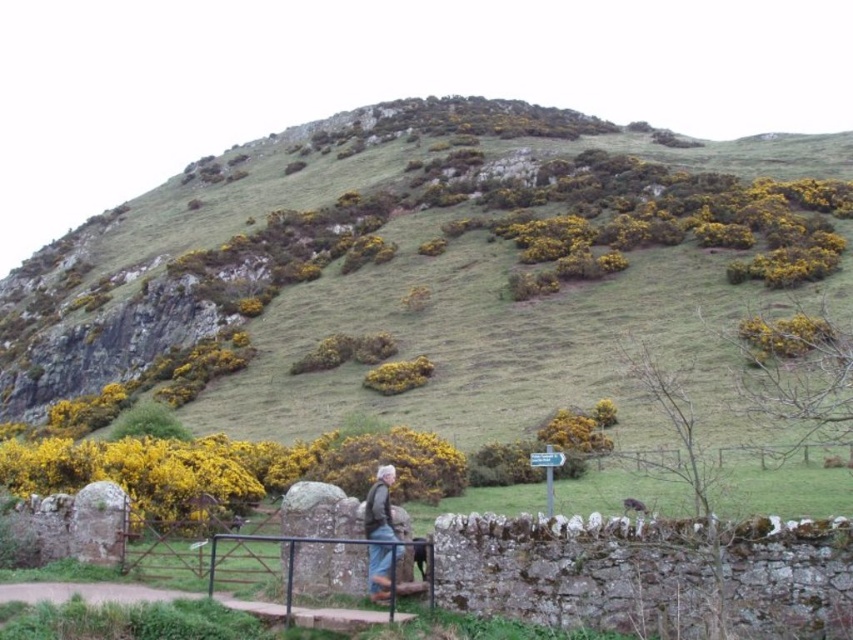
Question: Is green grassy hillside at upper center positioned behind denim jacket at lower center?

Choices:
 (A) no
 (B) yes

Answer: (B)

Question: Does green grassy hillside at upper center lie behind denim jacket at lower center?

Choices:
 (A) yes
 (B) no

Answer: (A)

Question: Does green grassy hillside at upper center have a lesser width compared to denim jacket at lower center?

Choices:
 (A) yes
 (B) no

Answer: (B)

Question: Which object is farther from the camera taking this photo?

Choices:
 (A) green grassy hillside at upper center
 (B) denim jacket at lower center

Answer: (A)

Question: Which object is closer to the camera taking this photo?

Choices:
 (A) green grassy hillside at upper center
 (B) denim jacket at lower center

Answer: (B)

Question: Which object appears closest to the camera in this image?

Choices:
 (A) denim jacket at lower center
 (B) green grassy hillside at upper center

Answer: (A)